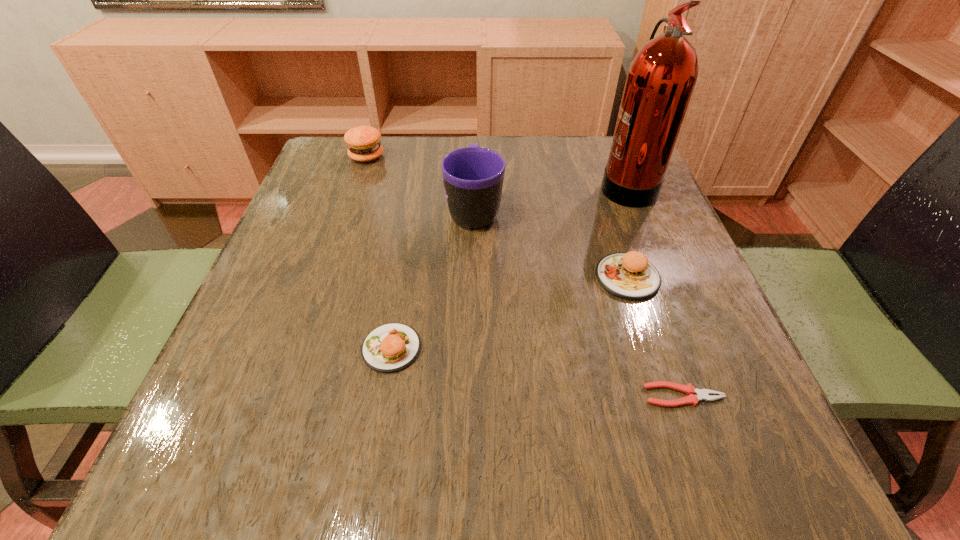
At what (x,y) coordinates should I click in order to perform the action: click on pliers. Please return your answer as a coordinate pair (x, y). Looking at the image, I should click on (701, 394).

Image resolution: width=960 pixels, height=540 pixels. I want to click on free spot located 0.050m on the front-facing side of the fire extinguisher, so click(578, 185).

Locate an element on the screen. The image size is (960, 540). vacant space located 0.230m on the front-facing side of the fire extinguisher is located at coordinates point(501,185).

Find the location of `free space located 0.220m on the front-facing side of the fire extinguisher`. free space located 0.220m on the front-facing side of the fire extinguisher is located at coordinates (505, 185).

Locate an element on the screen. This screenshot has width=960, height=540. vacant point located with the handle on the side of the second tallest object is located at coordinates (475, 157).

This screenshot has width=960, height=540. I want to click on free space located 0.210m with the handle on the side of the second tallest object, so click(475, 141).

Where is `vacant space located 0.130m with the handle on the side of the second tallest object`? The width and height of the screenshot is (960, 540). vacant space located 0.130m with the handle on the side of the second tallest object is located at coordinates (475, 157).

I want to click on free space located 0.330m on the front of the farthest patty, so (x=332, y=258).

Identify the location of vacant space located 0.260m on the left of the third nearest object. (456, 278).

Identify the location of vacant space located on the back of the second shortest object. The image size is (960, 540). (411, 230).